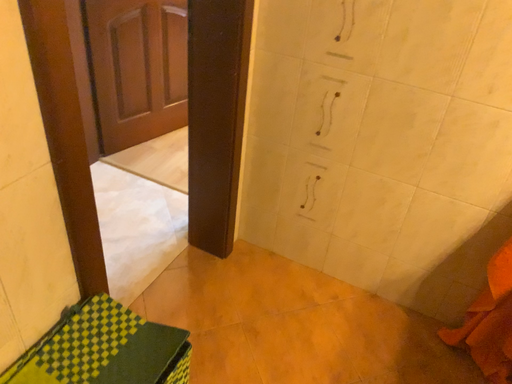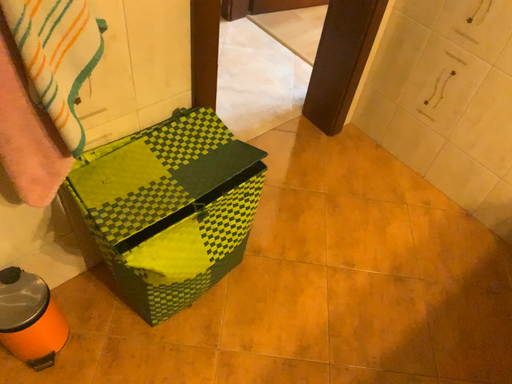
Question: Which way did the camera rotate in the video?

Choices:
 (A) rotated right
 (B) rotated left

Answer: (B)